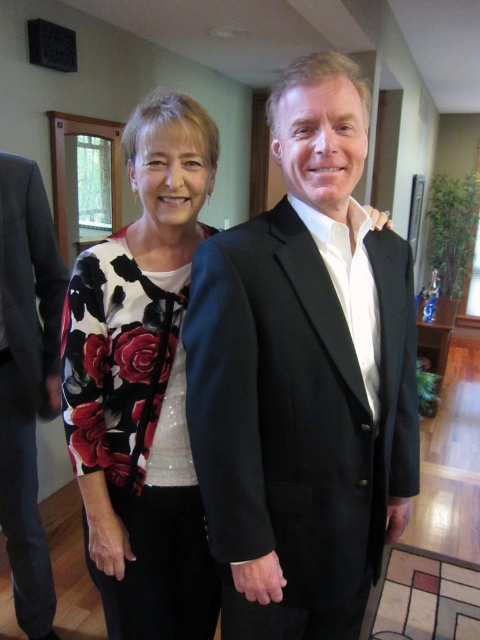
You are a photographer adjusting your camera to focus on the black smooth suit at center and the dark gray wool suit at left. Which suit should you focus on first to ensure it appears sharp in the photo?

The black smooth suit at center is closer to the viewer than the dark gray wool suit at left, so you should focus on the black smooth suit at center first to ensure it appears sharp.

You are a photographer setting up for a group photo. You need to arrange two people wearing the black smooth suit at center and the dark gray wool suit at left. Based on their current positions and the space available, can you fit both of them side by side without overlapping?

The black smooth suit at center might be wider than dark gray wool suit at left, so there is a possibility that they might overlap if placed side by side. Ensure there is enough space between them to accommodate their widths.